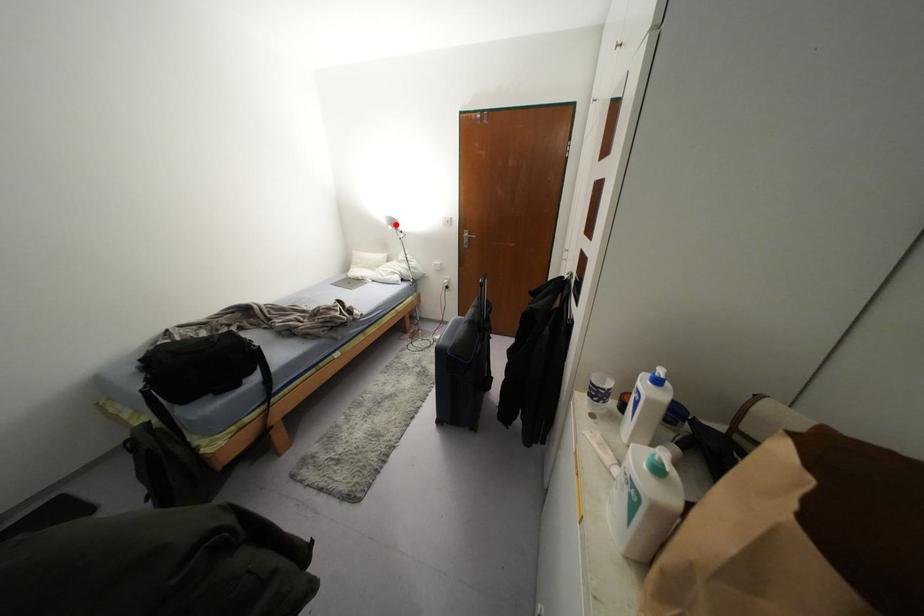
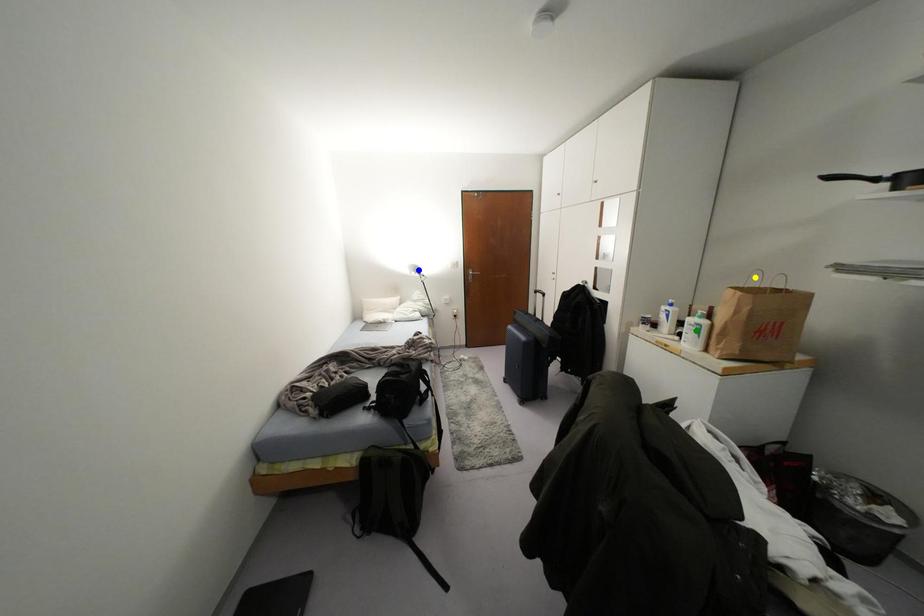
Question: I am providing you with two images of the same scene from different viewpoints. A red point is marked on the first image. You are given multiple points on the second image. In image 2, which mark is for the same physical point as the one in image 1?

Choices:
 (A) blue point
 (B) green point
 (C) yellow point

Answer: (A)